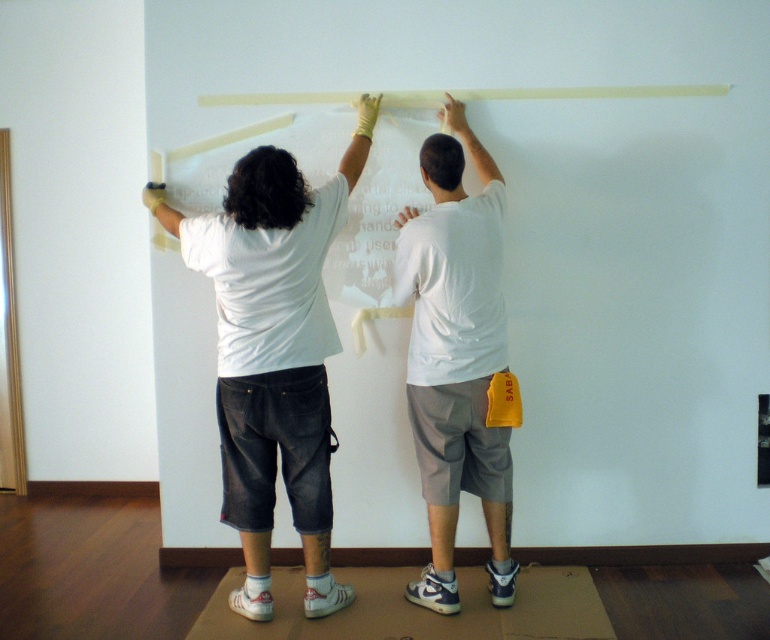
Can you confirm if white matte t-shirt at center is positioned below white matte t-shirt at upper center?

Yes.

Is white matte t-shirt at center shorter than white matte t-shirt at upper center?

No, white matte t-shirt at center is not shorter than white matte t-shirt at upper center.

The width and height of the screenshot is (770, 640). Find the location of `white matte t-shirt at center`. white matte t-shirt at center is located at coordinates (273, 349).

Find the location of a particular element. The width and height of the screenshot is (770, 640). white matte t-shirt at center is located at coordinates (273, 349).

Which is below, white matte t-shirt at upper center or translucent plastic tape at upper center?

white matte t-shirt at upper center is lower down.

Does white matte t-shirt at upper center appear over translucent plastic tape at upper center?

Incorrect, white matte t-shirt at upper center is not positioned above translucent plastic tape at upper center.

Is point (494, 356) positioned after point (407, 92)?

That is False.

Find the location of a particular element. The height and width of the screenshot is (640, 770). white matte t-shirt at upper center is located at coordinates (457, 356).

Which is above, white matte t-shirt at center or translucent plastic tape at upper center?

translucent plastic tape at upper center

Can you confirm if white matte t-shirt at center is positioned above translucent plastic tape at upper center?

No, white matte t-shirt at center is not above translucent plastic tape at upper center.

Which is behind, point (245, 196) or point (250, 99)?

The point (250, 99) is behind.

The image size is (770, 640). Find the location of `white matte t-shirt at center`. white matte t-shirt at center is located at coordinates (273, 349).